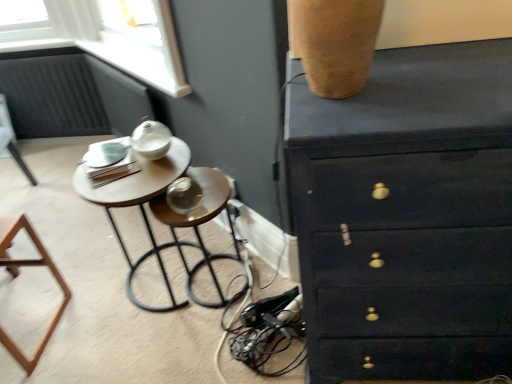
You are a GUI agent. You are given a task and a screenshot of the screen. Output one action in this format:
    pyautogui.click(x=<x>, y=<y>)
    Task: Click on the free point above matte wood side table at left (from a real-world perspective)
    This screenshot has width=512, height=384.
    Given the screenshot: What is the action you would take?
    pyautogui.click(x=127, y=173)